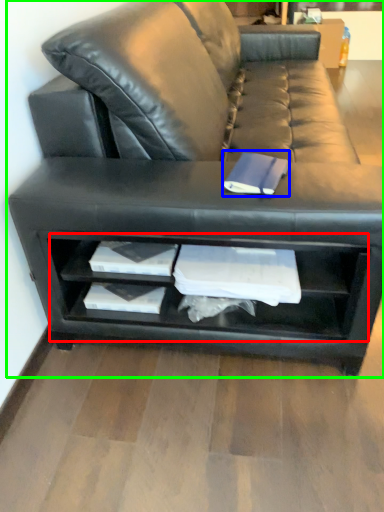
Question: Which object is the closest to the shelf (highlighted by a red box)? Choose among these: paperback book (highlighted by a blue box) or studio couch (highlighted by a green box).

Choices:
 (A) paperback book
 (B) studio couch

Answer: (B)